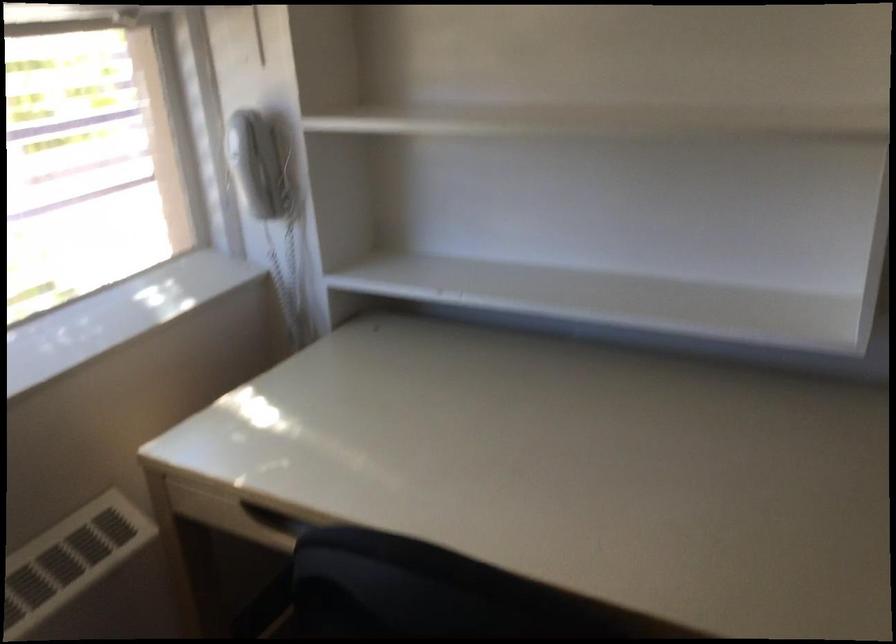
Identify the location of drawer handle. The width and height of the screenshot is (896, 644). (239, 516).